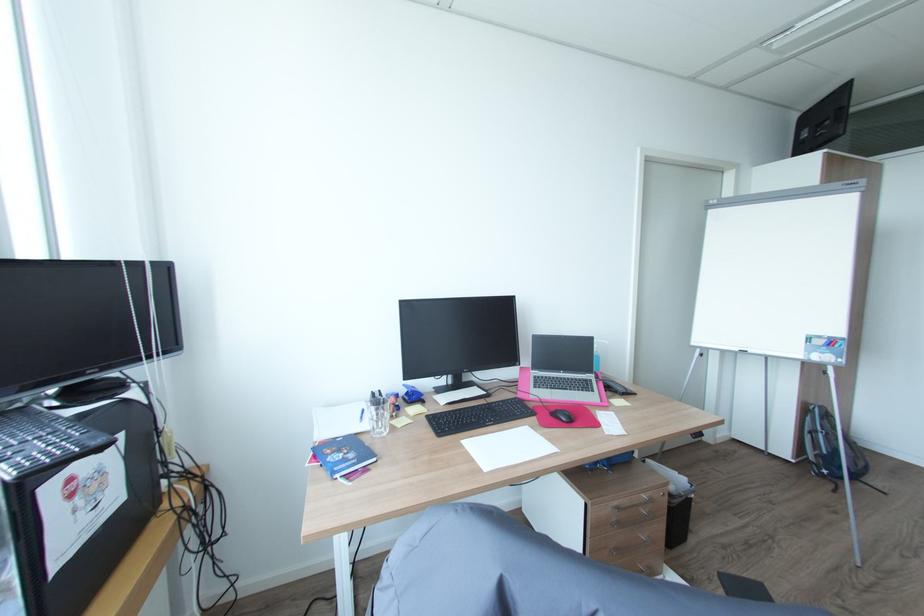
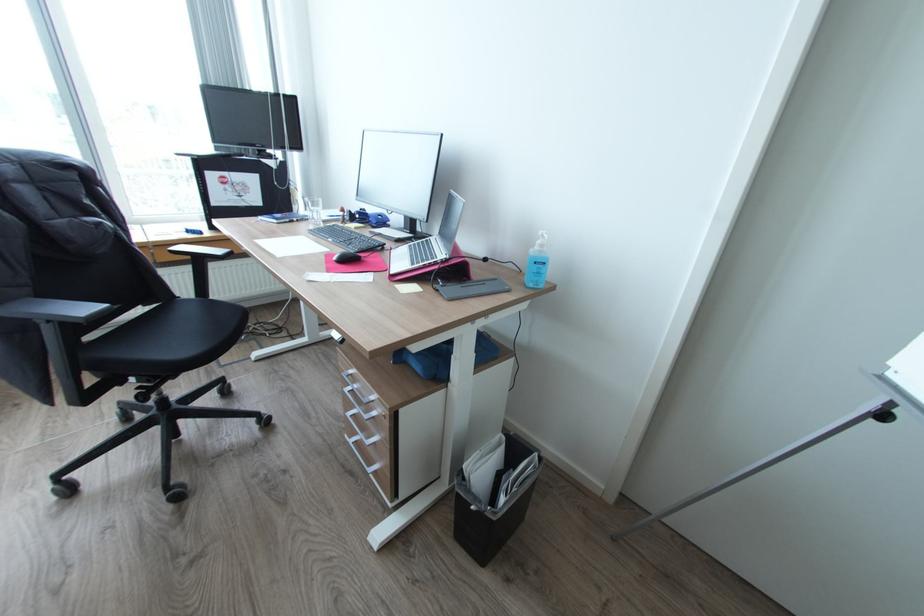
In the second image, find the point that corresponds to (x=540, y=378) in the first image.

(432, 238)